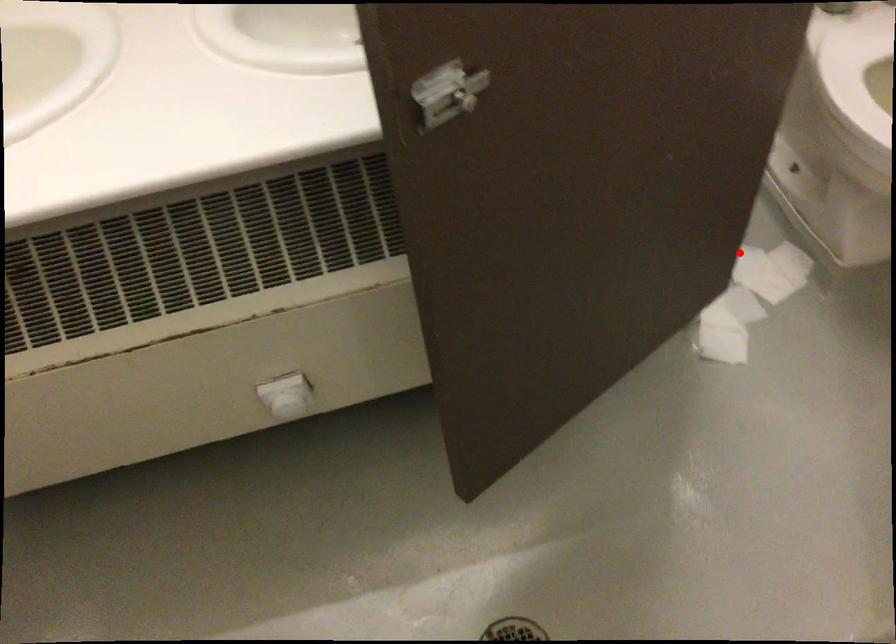
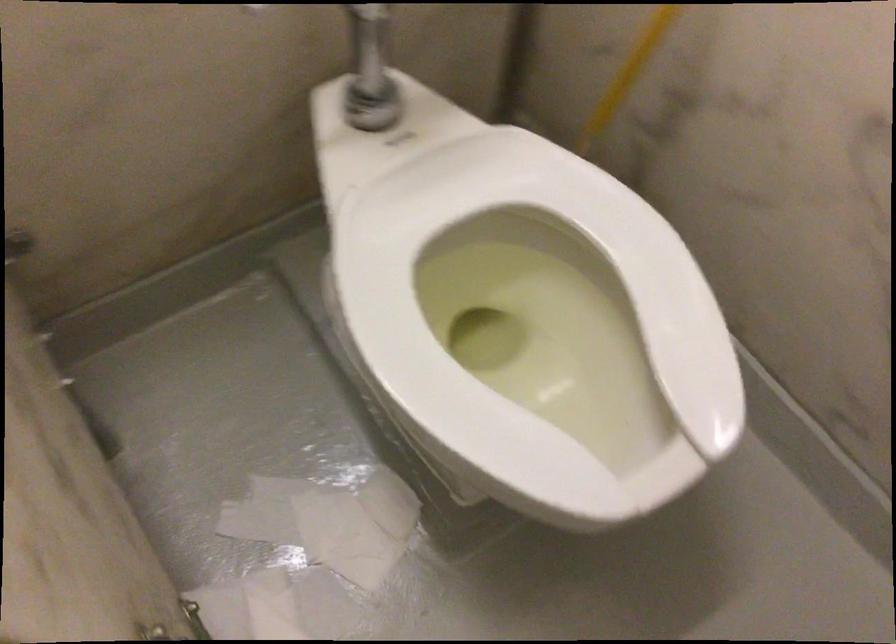
In the second image, find the point that corresponds to the highlighted location in the first image.

(320, 529)